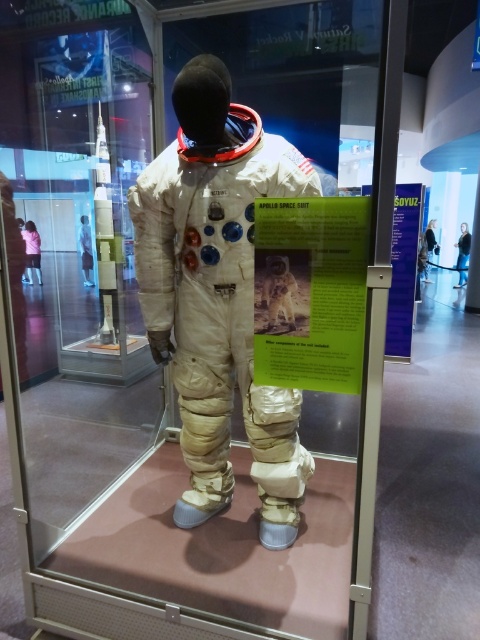
Who is taller, white fabric astronaut at center or green paper at center?

white fabric astronaut at center

Is white fabric astronaut at center smaller than green paper at center?

No.

You are a GUI agent. You are given a task and a screenshot of the screen. Output one action in this format:
    pyautogui.click(x=<x>, y=<y>)
    Task: Click on the white fabric astronaut at center
    This screenshot has height=640, width=480.
    Given the screenshot: What is the action you would take?
    pyautogui.click(x=217, y=294)

Does white fabric astronaut at center come in front of purple paper at right?

That is True.

Does white fabric astronaut at center appear under purple paper at right?

Yes, white fabric astronaut at center is below purple paper at right.

Does point (208, 304) come behind point (412, 253)?

No, (208, 304) is closer to viewer.

Find the location of a particular element. This screenshot has height=640, width=480. white fabric astronaut at center is located at coordinates (217, 294).

Where is `green paper at center`? The height and width of the screenshot is (640, 480). green paper at center is located at coordinates (310, 291).